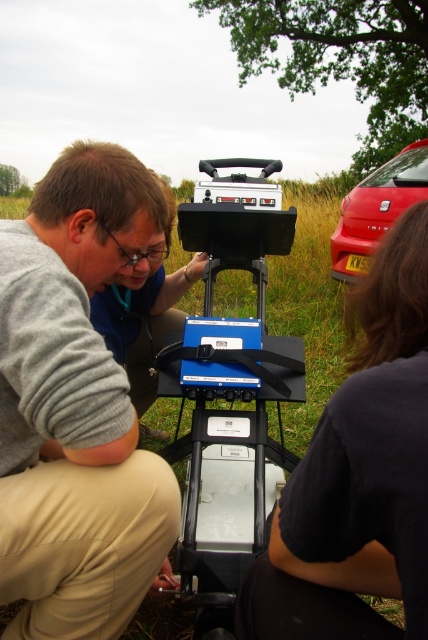
Question: Which of the following is the closest to the observer?

Choices:
 (A) gray fabric shirt at center
 (B) dark gray fabric at lower right

Answer: (B)

Question: Does gray fabric shirt at center have a larger size compared to dark gray fabric at lower right?

Choices:
 (A) no
 (B) yes

Answer: (B)

Question: Can you confirm if dark gray fabric at lower right is wider than metallic red car at right?

Choices:
 (A) no
 (B) yes

Answer: (B)

Question: Considering the relative positions of gray fabric shirt at center and dark gray fabric at lower right in the image provided, where is gray fabric shirt at center located with respect to dark gray fabric at lower right?

Choices:
 (A) below
 (B) above

Answer: (B)

Question: Which of these objects is positioned closest to the metallic red car at right?

Choices:
 (A) gray fabric shirt at center
 (B) dark gray fabric at lower right

Answer: (A)

Question: Considering the real-world distances, which object is farthest from the dark gray fabric at lower right?

Choices:
 (A) metallic red car at right
 (B) gray fabric shirt at center

Answer: (A)